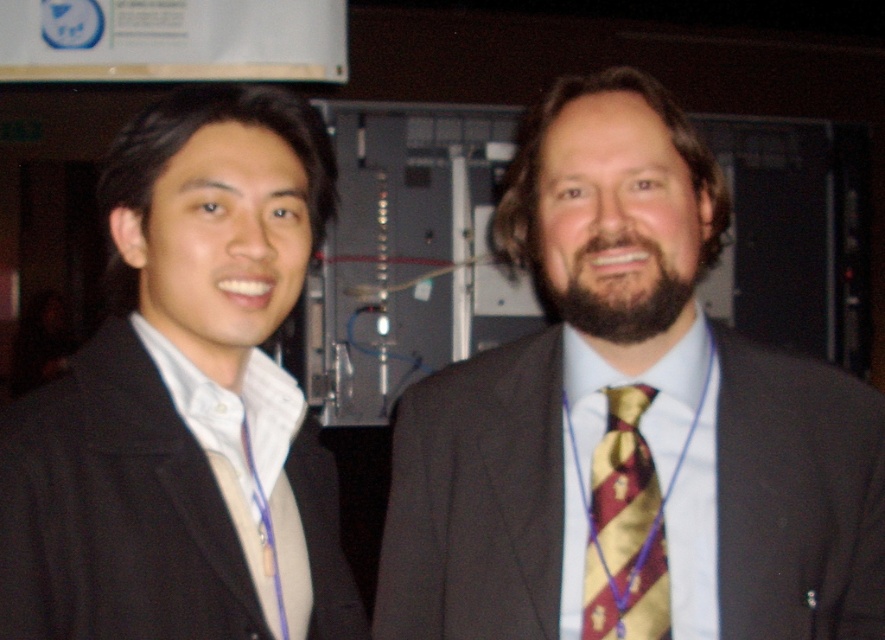
Is maroon and gold striped tie at center shorter than black matte suit at left?

No.

Which is in front, point (833, 460) or point (352, 611)?

Point (833, 460)

Is point (395, 592) positioned behind point (51, 410)?

Yes, point (395, 592) is farther from viewer.

The width and height of the screenshot is (885, 640). I want to click on maroon and gold striped tie at center, so click(628, 419).

Based on the photo, who is positioned more to the left, maroon and gold striped tie at center or maroon striped tie at center?

From the viewer's perspective, maroon striped tie at center appears more on the left side.

Does maroon and gold striped tie at center lie in front of maroon striped tie at center?

Yes, maroon and gold striped tie at center is in front of maroon striped tie at center.

Where is `maroon and gold striped tie at center`? The width and height of the screenshot is (885, 640). maroon and gold striped tie at center is located at coordinates (628, 419).

You are a GUI agent. You are given a task and a screenshot of the screen. Output one action in this format:
    pyautogui.click(x=<x>, y=<y>)
    Task: Click on the maroon and gold striped tie at center
    This screenshot has width=885, height=640.
    Given the screenshot: What is the action you would take?
    pyautogui.click(x=628, y=419)

Which is below, black matte suit at left or maroon striped tie at center?

maroon striped tie at center is below.

Locate an element on the screen. The image size is (885, 640). black matte suit at left is located at coordinates (163, 378).